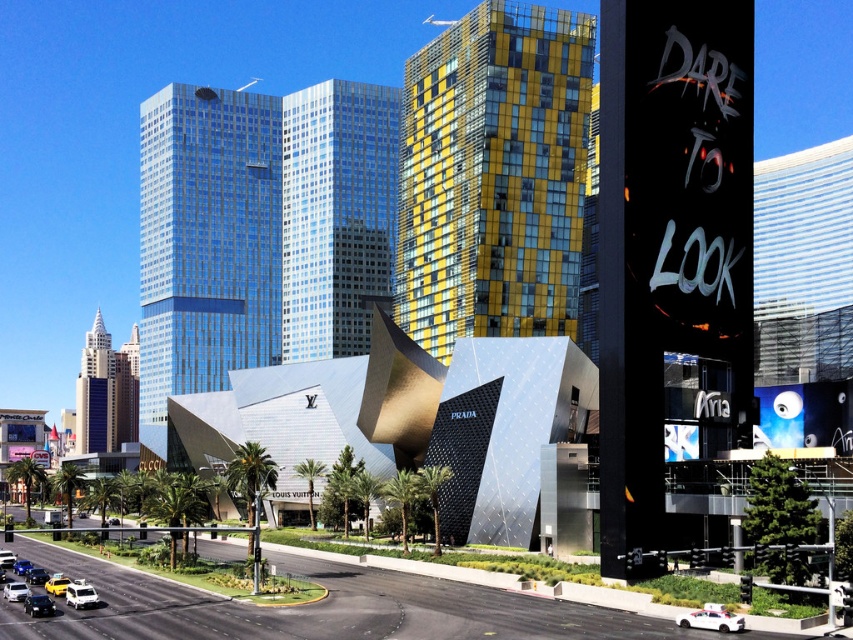
Can you confirm if white matte van at lower left is thinner than yellow matte taxi cab at lower left?

Correct, white matte van at lower left's width is less than yellow matte taxi cab at lower left's.

Is white matte van at lower left further to camera compared to yellow matte taxi cab at lower left?

No, it is in front of yellow matte taxi cab at lower left.

Who is more forward, (80, 605) or (30, 576)?

Point (80, 605) is in front.

You are a GUI agent. You are given a task and a screenshot of the screen. Output one action in this format:
    pyautogui.click(x=<x>, y=<y>)
    Task: Click on the white matte van at lower left
    
    Given the screenshot: What is the action you would take?
    pyautogui.click(x=80, y=595)

Who is positioned more to the right, white matte van at lower left or white matte car at lower left?

Positioned to the right is white matte van at lower left.

This screenshot has height=640, width=853. Find the location of `white matte van at lower left`. white matte van at lower left is located at coordinates (80, 595).

Is white glossy car at lower center closer to the viewer compared to white matte van at lower left?

Yes, white glossy car at lower center is closer to the viewer.

Which is in front, point (732, 621) or point (80, 582)?

Positioned in front is point (732, 621).

Is point (677, 621) positioned behind point (91, 592)?

No, it is not.

In order to click on white glossy car at lower center in this screenshot , I will do `click(711, 618)`.